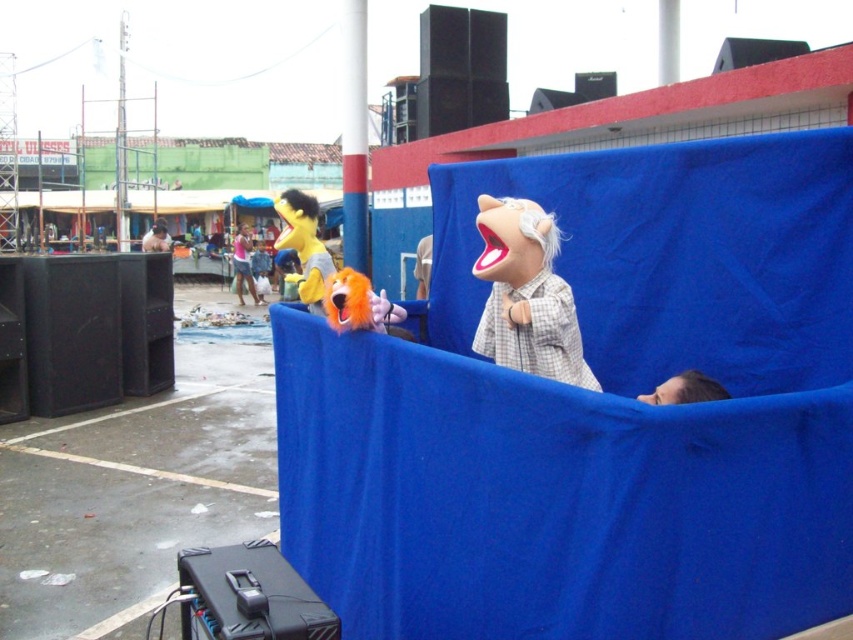
Question: Considering the real-world distances, which object is farthest from the plush/textured puppet at center?

Choices:
 (A) orange plush toy at center
 (B) matte yellow plush at center

Answer: (B)

Question: From the image, what is the correct spatial relationship of matte yellow plush at center in relation to orange plush toy at center?

Choices:
 (A) above
 (B) below

Answer: (A)

Question: From the image, what is the correct spatial relationship of matte yellow plush at center in relation to orange plush toy at center?

Choices:
 (A) left
 (B) right

Answer: (A)

Question: Which of these objects is positioned farthest from the matte yellow plush at center?

Choices:
 (A) orange plush toy at center
 (B) plush/textured puppet at center

Answer: (A)

Question: Considering the relative positions of plush/textured puppet at center and orange plush toy at center in the image provided, where is plush/textured puppet at center located with respect to orange plush toy at center?

Choices:
 (A) below
 (B) above

Answer: (B)

Question: Which point is farther to the camera?

Choices:
 (A) (326, 300)
 (B) (502, 248)
 (C) (312, 234)

Answer: (C)